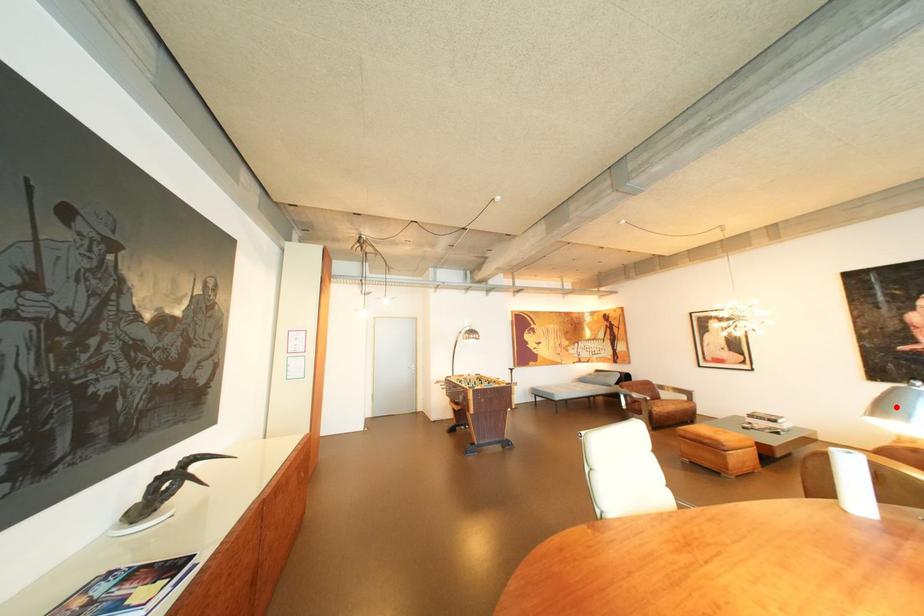
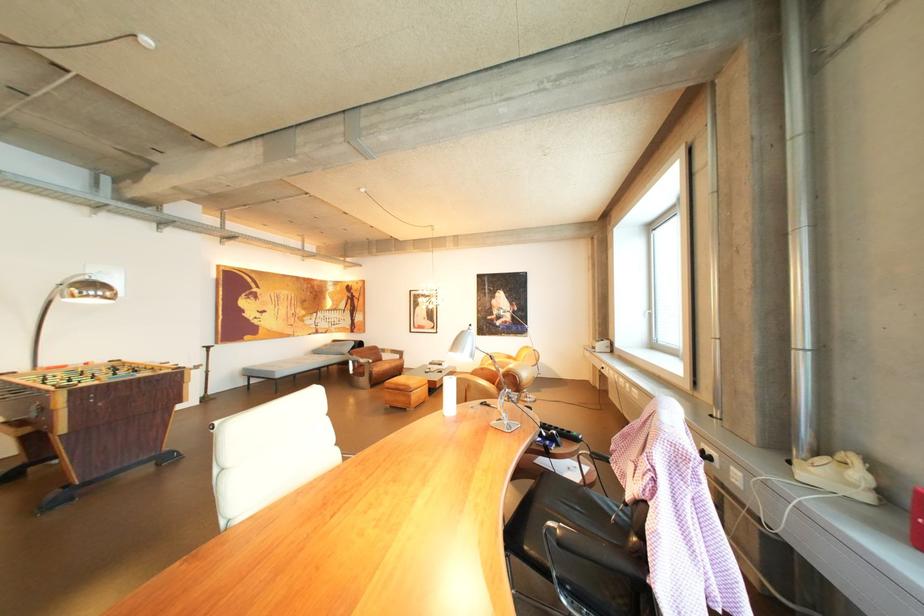
Question: I am providing you with two images of the same scene from different viewpoints. Given a red point in image1, look at the same physical point in image2. Is it:

Choices:
 (A) Closer to the viewpoint
 (B) Farther from the viewpoint

Answer: (B)